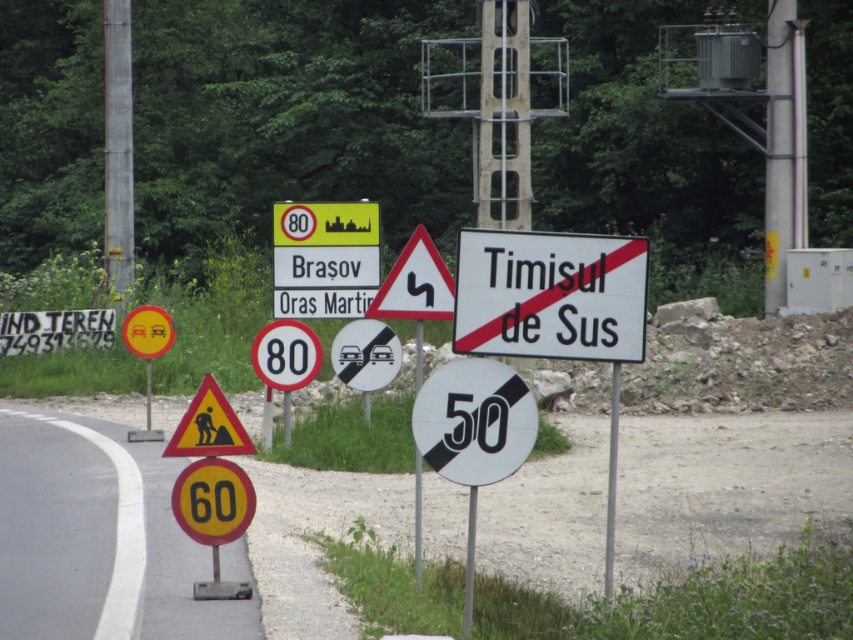
You are driving and see the yellow matte speed limit sign at lower left and the black plastic speed limit sign at center. Which one is positioned lower in the image?

The yellow matte speed limit sign at lower left is positioned lower than the black plastic speed limit sign at center.

You are a driver approaching the road and see the yellow matte speed limit sign at lower left and the black plastic speed limit sign at center. Which sign has a larger width?

The black plastic speed limit sign at center is wider than the yellow matte speed limit sign at lower left, so the black plastic speed limit sign at center has a larger width.